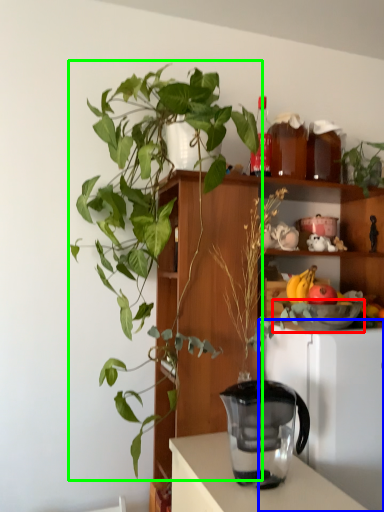
Question: Which object is positioned closest to bowl (highlighted by a red box)? Select from appliance (highlighted by a blue box) and houseplant (highlighted by a green box).

Choices:
 (A) appliance
 (B) houseplant

Answer: (A)